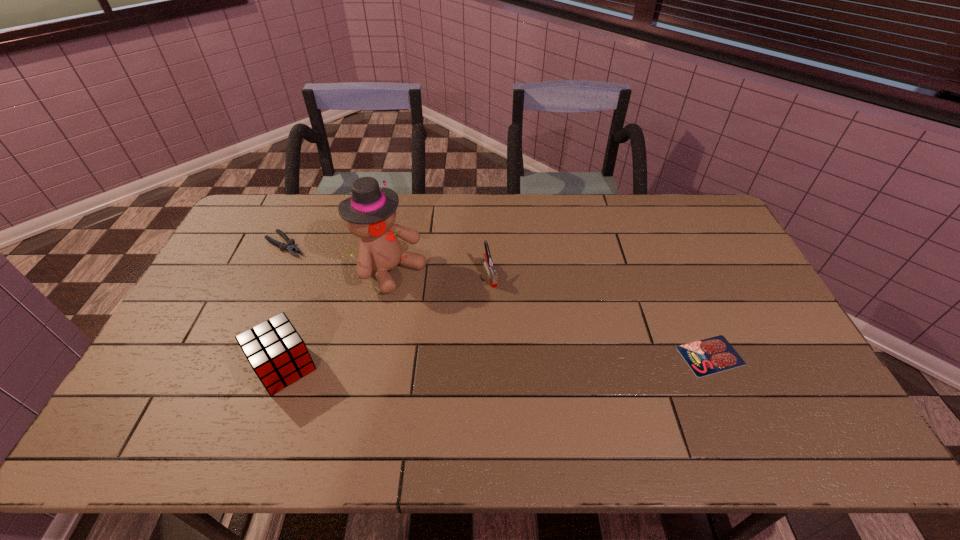
Find the location of a particular element. free point at the far right corner is located at coordinates (725, 233).

The height and width of the screenshot is (540, 960). Find the location of `unoccupied position between the stapler and the second tallest object`. unoccupied position between the stapler and the second tallest object is located at coordinates (387, 320).

Identify the location of vacant area between the fourth shortest object and the fourth object from left to right. (387, 320).

What are the coordinates of `free space between the tallest object and the salami` in the screenshot? It's located at (550, 313).

Find the location of a particular element. This screenshot has width=960, height=540. unoccupied area between the rightmost object and the cube is located at coordinates (497, 361).

The height and width of the screenshot is (540, 960). I want to click on vacant space that is in between the tallest object and the second object from right to left, so click(x=440, y=272).

I want to click on vacant region between the pliers and the shortest object, so click(x=498, y=300).

Locate an element on the screen. This screenshot has height=540, width=960. empty space between the pliers and the salami is located at coordinates (498, 300).

You are a GUI agent. You are given a task and a screenshot of the screen. Output one action in this format:
    pyautogui.click(x=<x>, y=<y>)
    Task: Click on the unoccupied area between the third tallest object and the salami
    Image resolution: width=960 pixels, height=540 pixels.
    Given the screenshot: What is the action you would take?
    pyautogui.click(x=600, y=314)

Where is `free area in between the shortest object and the cube`? This screenshot has height=540, width=960. free area in between the shortest object and the cube is located at coordinates (497, 361).